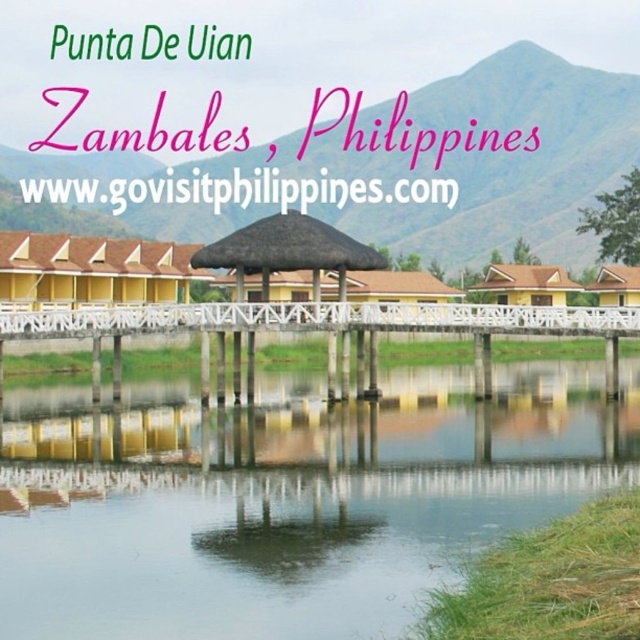
Is brown thatched roof hut at center further to the viewer compared to yellow matte hut at lower right?

No, brown thatched roof hut at center is closer to the viewer.

Is point (516, 275) closer to viewer compared to point (596, 282)?

Yes, it is in front of point (596, 282).

Find the location of a particular element. brown thatched roof hut at center is located at coordinates (528, 284).

Identify the location of transparent water at center. Image resolution: width=640 pixels, height=640 pixels. (288, 497).

Who is positioned more to the left, transparent water at center or yellow corrugated metal hut at center?

From the viewer's perspective, yellow corrugated metal hut at center appears more on the left side.

Between point (374, 522) and point (184, 296), which one is positioned behind?

The point (184, 296) is more distant.

This screenshot has height=640, width=640. I want to click on transparent water at center, so click(288, 497).

Does point (376, 332) come closer to viewer compared to point (632, 300)?

Yes.

Measure the distance between white wooden dock at center and yellow matte hut at lower right.

36.40 meters

Does point (609, 312) lie in front of point (616, 262)?

Yes, it is in front of point (616, 262).

Identify the location of white wooden dock at center. The height and width of the screenshot is (640, 640). (316, 324).